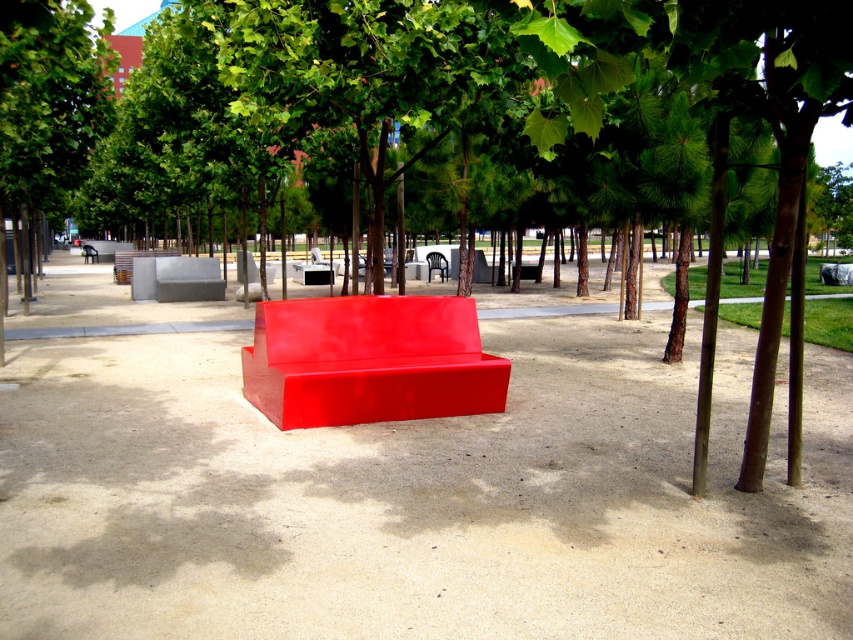
Question: Which of the following is the closest to the observer?

Choices:
 (A) black plastic chair at center
 (B) matte gray bench at center
 (C) glossy red bench at center

Answer: (C)

Question: Does matte gray bench at center appear on the left side of black plastic chair at center?

Choices:
 (A) no
 (B) yes

Answer: (B)

Question: Which of the following is the closest to the observer?

Choices:
 (A) (122, 276)
 (B) (286, 307)

Answer: (B)

Question: Does matte gray bench at center appear over black plastic chair at center?

Choices:
 (A) yes
 (B) no

Answer: (A)

Question: Can you confirm if glossy red bench at center is positioned to the left of black plastic chair at center?

Choices:
 (A) yes
 (B) no

Answer: (A)

Question: Which object is positioned closest to the glossy red bench at center?

Choices:
 (A) black plastic chair at center
 (B) matte gray bench at center

Answer: (B)